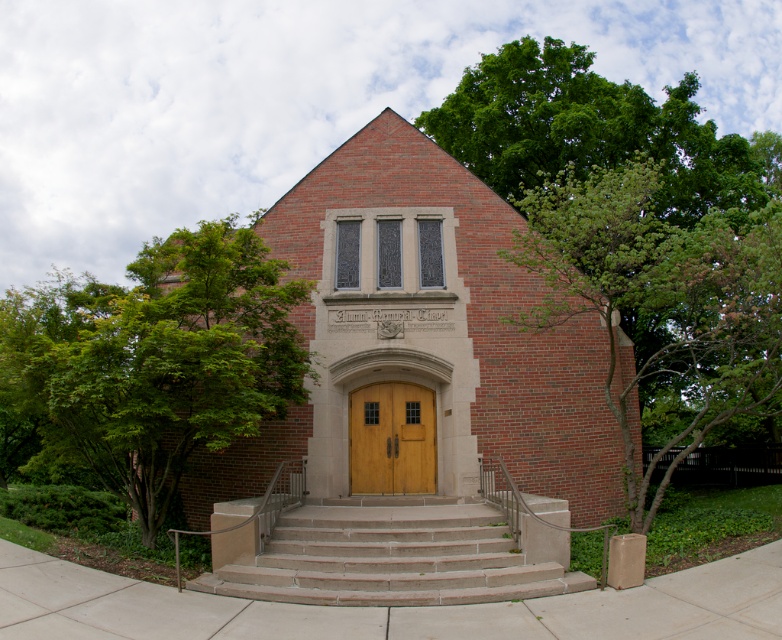
You are standing in front of the Alumni Memorial Chapel and want to enter through the central entrance. There are two structures at the center. Which one is lower in height between the smooth concrete stairs at center and the wooden at center?

The smooth concrete stairs at center is below wooden at center, so the smooth concrete stairs at center is lower in height.

You are standing in front of the Alumni Memorial Chapel and notice a green leafy tree at upper right and a wooden at center. Which object is larger in size?

The green leafy tree at upper right is bigger than the wooden at center.

You are standing in front of the Alumni Memorial Chapel. Where is the brick building at center located in the image?

The brick building at center is located at the point with coordinates (425, 336) in the image.